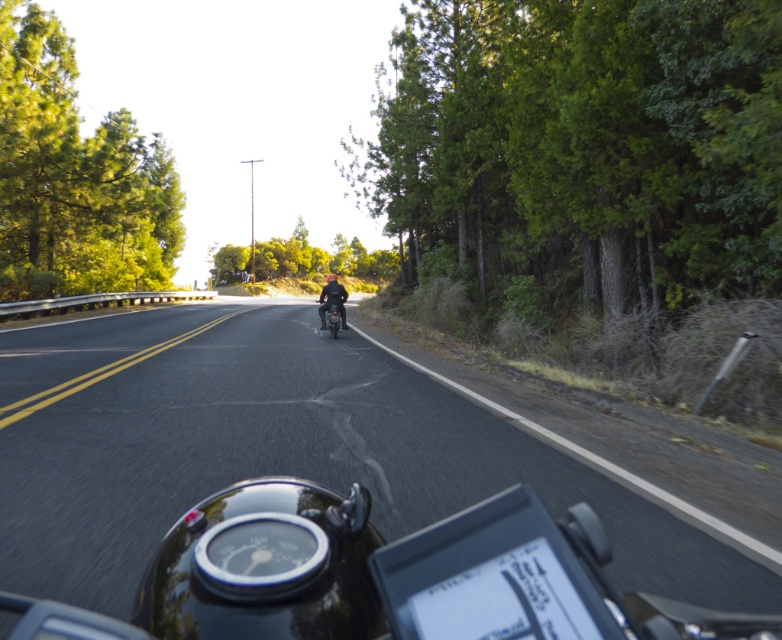
Consider the image. Between green leafy tree at center and matte black motorcycle at center, which one is positioned higher?

green leafy tree at center

Does point (293, 236) lie in front of point (321, 310)?

No.

Identify the location of green leafy tree at center. Image resolution: width=782 pixels, height=640 pixels. (300, 259).

Is green leafy tree at left positioned at the back of matte black motorcycle at center?

Yes, green leafy tree at left is behind matte black motorcycle at center.

Is green leafy tree at left wider than matte black motorcycle at center?

Yes.

Where is `green leafy tree at left`? green leafy tree at left is located at coordinates (74, 177).

Which is in front, point (325, 288) or point (332, 326)?

Point (332, 326)

The height and width of the screenshot is (640, 782). I want to click on matte black motorcycle at center, so click(x=332, y=300).